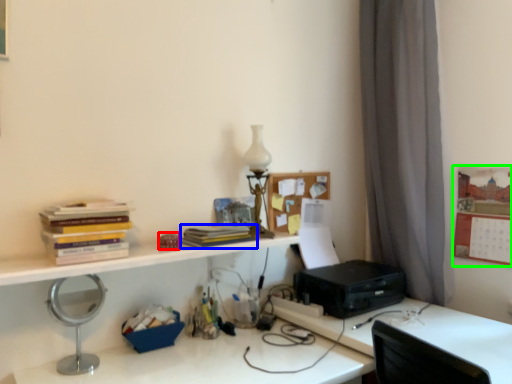
Question: Considering the real-world distances, which object is closest to stationery (highlighted by a red box)? paperback book (highlighted by a blue box) or bulletin board (highlighted by a green box).

Choices:
 (A) paperback book
 (B) bulletin board

Answer: (A)